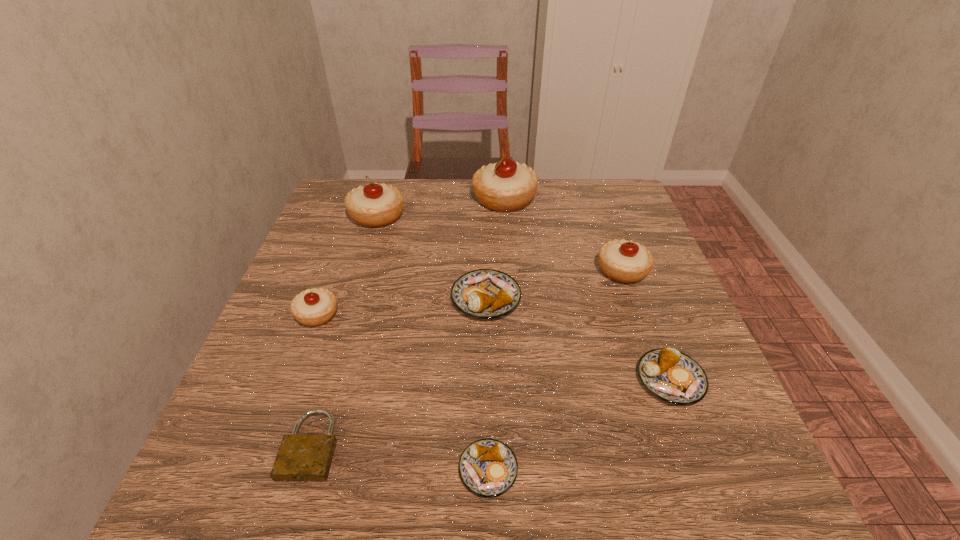
Find the location of a particular element. The width and height of the screenshot is (960, 540). free space located 0.130m on the back of the second smallest brown pastry is located at coordinates (641, 305).

What are the coordinates of `free space located on the right of the seventh tallest object` in the screenshot? It's located at (564, 470).

Find the location of a particular element. Image resolution: width=960 pixels, height=540 pixels. pastry that is at the near edge is located at coordinates (488, 468).

Find the location of `padlock that is at the near edge`. padlock that is at the near edge is located at coordinates (301, 457).

You are a GUI agent. You are given a task and a screenshot of the screen. Output one action in this format:
    pyautogui.click(x=<x>, y=<y>)
    Task: Click on the padlock present at the left edge
    This screenshot has height=540, width=960.
    Given the screenshot: What is the action you would take?
    pyautogui.click(x=301, y=457)

Find the location of a particular element. This screenshot has width=960, height=540. object located in the far left corner section of the desktop is located at coordinates (374, 205).

This screenshot has height=540, width=960. I want to click on object situated at the near left corner, so click(x=301, y=457).

Where is `vacant area at the far edge of the desktop`? vacant area at the far edge of the desktop is located at coordinates (452, 181).

Identify the location of free space at the near edge of the desktop. The height and width of the screenshot is (540, 960). (410, 513).

The image size is (960, 540). Find the location of `vacant space at the left edge of the desktop`. vacant space at the left edge of the desktop is located at coordinates (331, 250).